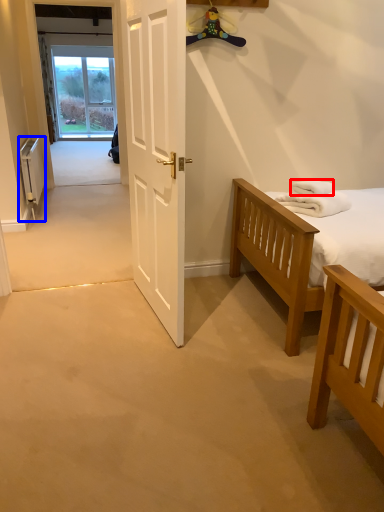
Question: Which object appears closest to the camera in this image, towel/napkin (highlighted by a red box) or radiator (highlighted by a blue box)?

Choices:
 (A) towel/napkin
 (B) radiator

Answer: (A)